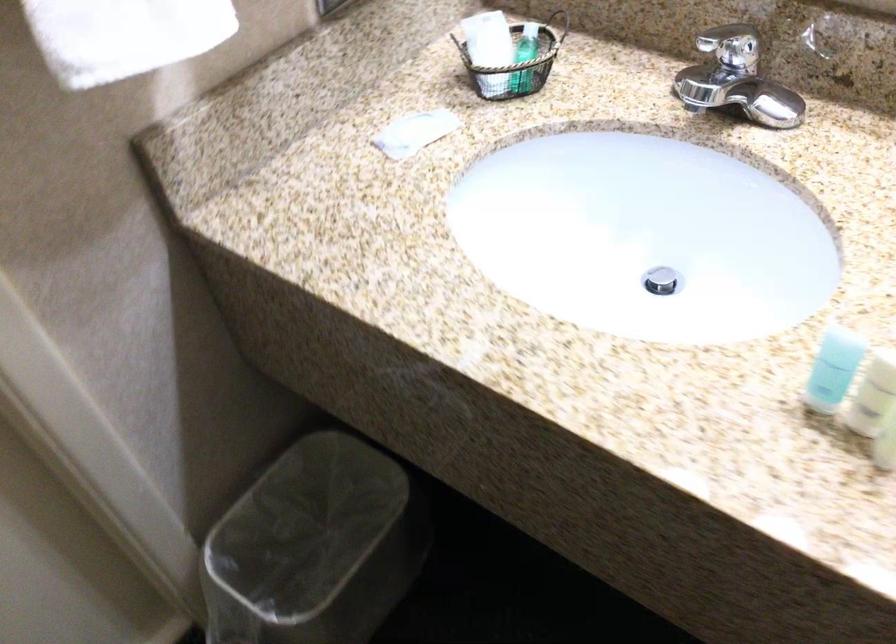
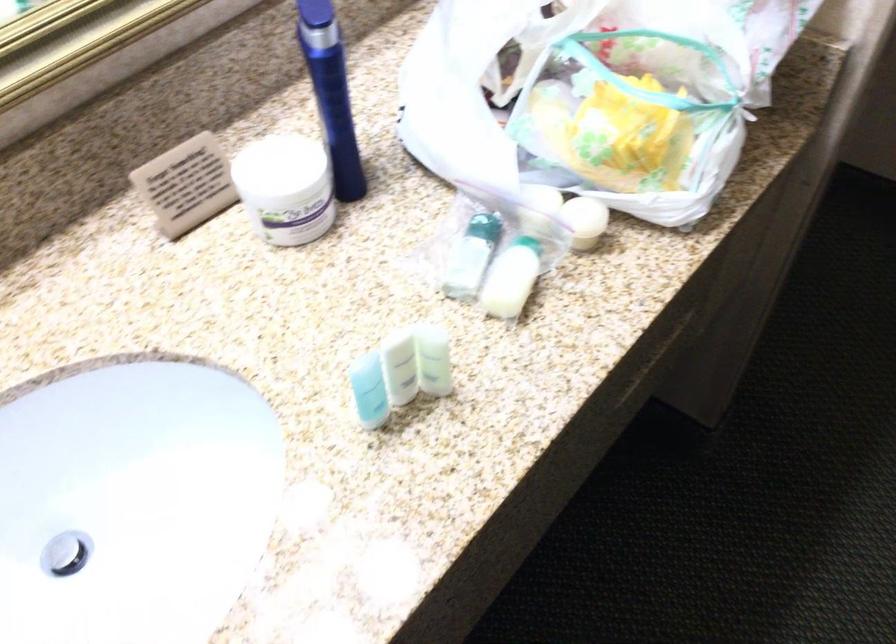
How did the camera likely rotate?

The camera rotated toward right-down.